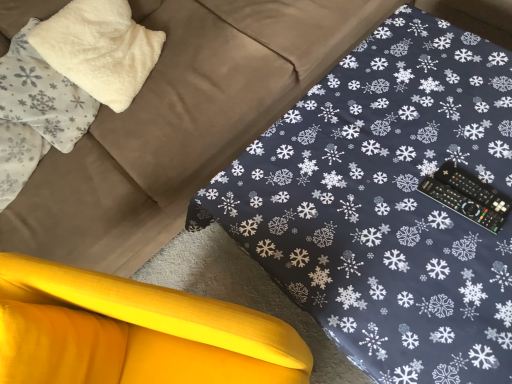
You are a GUI agent. You are given a task and a screenshot of the screen. Output one action in this format:
    pyautogui.click(x=<x>, y=<y>)
    Task: Click on the vacant area to the left of black plastic remote at right
    The image size is (512, 384).
    Given the screenshot: What is the action you would take?
    pyautogui.click(x=400, y=241)